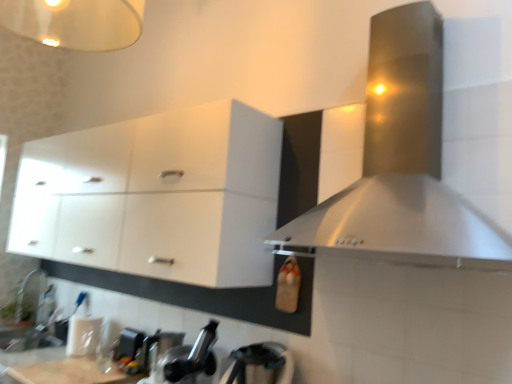
Question: Looking at the image, does black matte faucet at lower center, the second appliance viewed from the back, seem bigger or smaller compared to stainless steel range hood at upper right?

Choices:
 (A) big
 (B) small

Answer: (B)

Question: From a real-world perspective, relative to stainless steel range hood at upper right, is black matte faucet at lower center, positioned as the second appliance in front-to-back order, vertically above or below?

Choices:
 (A) below
 (B) above

Answer: (A)

Question: Estimate the real-world distances between objects in this image. Which object is closer to the stainless steel range hood at upper right?

Choices:
 (A) metallic gray toaster at lower left, arranged as the first appliance when viewed from the back
 (B) white glossy sink at lower left
 (C) white glossy cabinet at upper left
 (D) black matte faucet at lower center, the 2th appliance in the left-to-right sequence
 (E) brushed metal faucet at lower left

Answer: (C)

Question: Which is farther from the stainless steel range hood at upper right?

Choices:
 (A) white glossy sink at lower left
 (B) white glossy cabinet at upper left
 (C) brushed metal faucet at lower left
 (D) metallic gray toaster at lower left, arranged as the first appliance when viewed from the back
 (E) black matte faucet at lower center, acting as the second appliance starting from the right

Answer: (C)